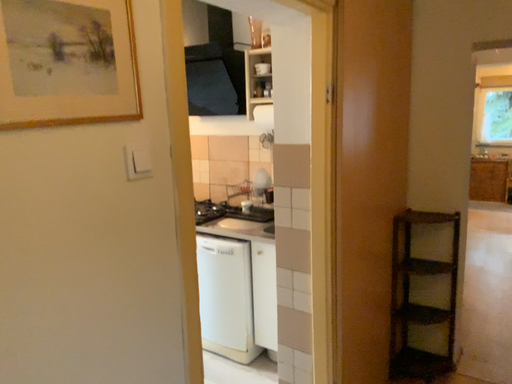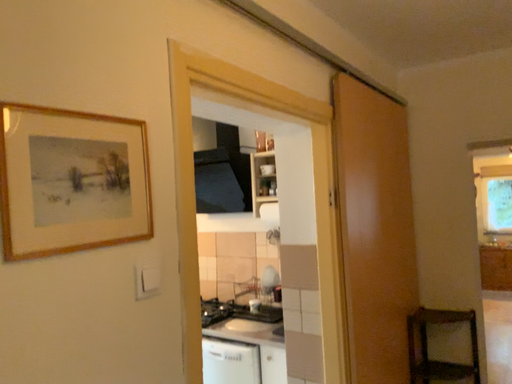
Question: Which way did the camera rotate in the video?

Choices:
 (A) rotated downward
 (B) rotated upward

Answer: (B)